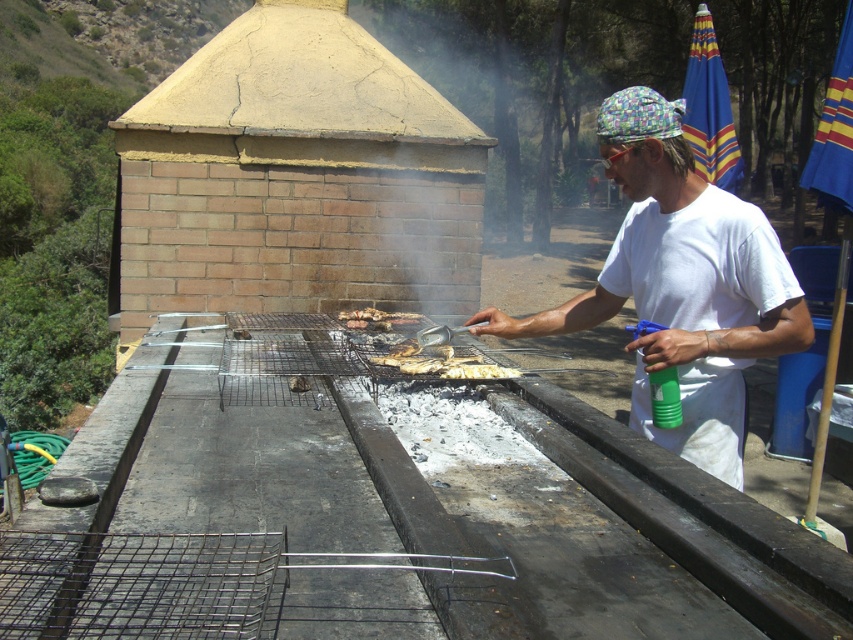
Which is in front, point (643, 404) or point (381, 324)?

Point (643, 404) is more forward.

Does white cotton shirt at center have a greater width compared to charcoal briquettes at center?

Correct, the width of white cotton shirt at center exceeds that of charcoal briquettes at center.

Does point (601, 298) come behind point (364, 312)?

No.

Image resolution: width=853 pixels, height=640 pixels. What are the coordinates of `white cotton shirt at center` in the screenshot? It's located at pos(682,284).